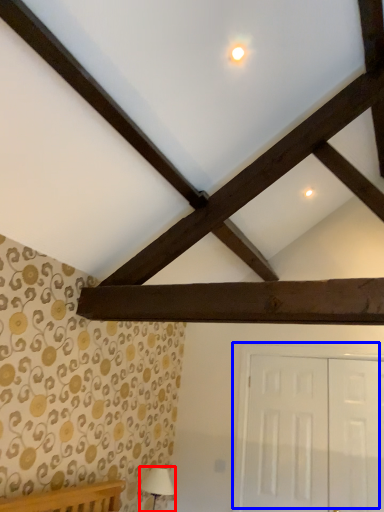
Question: Which point is further to the camera, table lamp (highlighted by a red box) or door (highlighted by a blue box)?

Choices:
 (A) table lamp
 (B) door

Answer: (A)